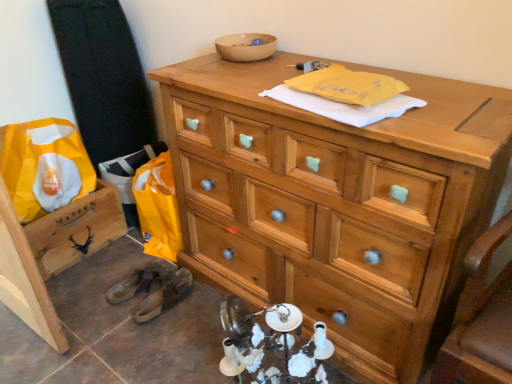
Question: Is wooden crate at lower left situated inside brown leather shoe at lower left, the 2th shoe when ordered from left to right, or outside?

Choices:
 (A) inside
 (B) outside

Answer: (B)

Question: Is wooden crate at lower left bigger or smaller than brown leather shoe at lower left, the 2th shoe when ordered from left to right?

Choices:
 (A) small
 (B) big

Answer: (B)

Question: Which is nearer to the brown leather shoe at lower left, the second shoe in the right-to-left sequence?

Choices:
 (A) wooden chest of drawers at upper center
 (B) wooden bowl at upper center
 (C) yellow paper bag at lower left
 (D) wooden crate at lower left
 (E) brown leather shoe at lower left, the 2th shoe when ordered from left to right

Answer: (E)

Question: Based on their relative distances, which object is nearer to the brown leather shoe at lower left, the 2th shoe when ordered from left to right?

Choices:
 (A) yellow paper bag at lower left
 (B) brown leather shoe at lower left, which is the 1th shoe in left-to-right order
 (C) wooden crate at lower left
 (D) wooden bowl at upper center
 (E) wooden chest of drawers at upper center

Answer: (B)